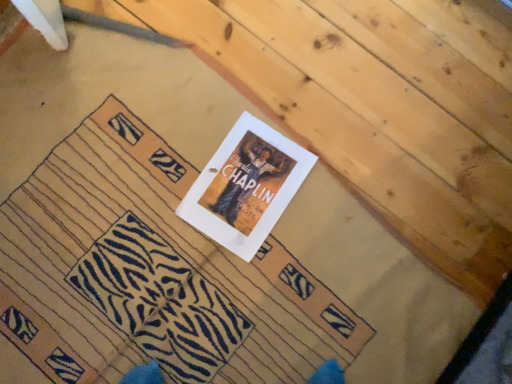
The height and width of the screenshot is (384, 512). I want to click on unoccupied space behind white paper at center, so click(229, 140).